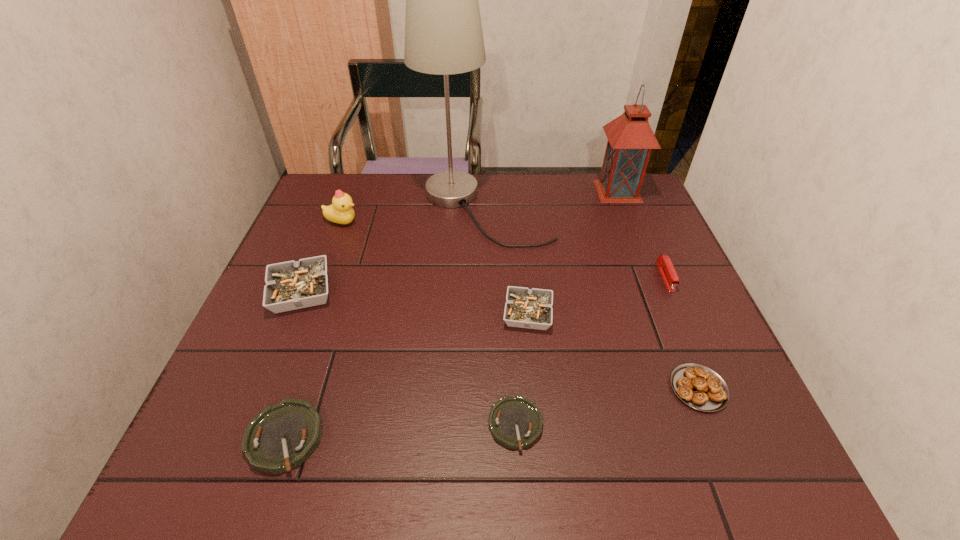
Image resolution: width=960 pixels, height=540 pixels. Identify the location of free area in between the smaller gray ashtray and the stapler. [596, 295].

Identify the location of free point between the shortest object and the pink lantern. The image size is (960, 540). (566, 308).

Image resolution: width=960 pixels, height=540 pixels. What are the coordinates of `free space between the third tallest object and the tallest object` in the screenshot? It's located at (413, 215).

Locate an element on the screen. Image resolution: width=960 pixels, height=540 pixels. free space between the second tallest ashtray and the third tallest object is located at coordinates (435, 268).

Locate an element on the screen. The image size is (960, 540). vacant space that's between the pink lantern and the smaller green ashtray is located at coordinates (566, 308).

Locate an element on the screen. free point between the pastry and the smaller gray ashtray is located at coordinates (613, 351).

Where is `free point between the shortest object and the right gray ashtray`? The width and height of the screenshot is (960, 540). free point between the shortest object and the right gray ashtray is located at coordinates (521, 369).

This screenshot has width=960, height=540. Identify the location of free area in between the right gray ashtray and the pastry. (613, 351).

Where is `free space between the smaller gray ashtray and the bigger green ashtray`? The height and width of the screenshot is (540, 960). free space between the smaller gray ashtray and the bigger green ashtray is located at coordinates (406, 376).

Find the location of a particular element. The width and height of the screenshot is (960, 540). free spot between the pink lantern and the second tallest ashtray is located at coordinates (573, 253).